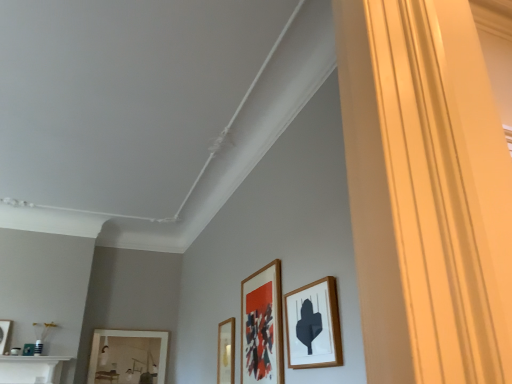
Question: Is matte white picture frame at lower left, which appears as the first picture frame when viewed from the left, wider than matte wooden picture frame at center, acting as the second picture frame starting from the right?

Choices:
 (A) yes
 (B) no

Answer: (A)

Question: From the image's perspective, is matte white picture frame at lower left, marked as the 2th picture frame in a back-to-front arrangement, beneath matte wooden picture frame at center, acting as the second picture frame starting from the right?

Choices:
 (A) yes
 (B) no

Answer: (A)

Question: Is matte white picture frame at lower left, the 5th picture frame from the right, not near matte wooden picture frame at center, the 4th picture frame positioned from the left?

Choices:
 (A) no
 (B) yes

Answer: (B)

Question: Can you confirm if matte white picture frame at lower left, which appears as the first picture frame when viewed from the left, is thinner than matte wooden picture frame at center, which is the fourth picture frame in back-to-front order?

Choices:
 (A) no
 (B) yes

Answer: (A)

Question: Can you confirm if matte white picture frame at lower left, which appears as the first picture frame when viewed from the left, is taller than matte wooden picture frame at center, marked as the second picture frame in a front-to-back arrangement?

Choices:
 (A) no
 (B) yes

Answer: (A)

Question: Is wooden picture frame at lower left, placed as the second picture frame when sorted from left to right, inside or outside of wooden picture frame at right, which is the fifth picture frame in back-to-front order?

Choices:
 (A) outside
 (B) inside

Answer: (A)

Question: From a real-world perspective, is wooden picture frame at lower left, the fourth picture frame positioned from the right, positioned above or below wooden picture frame at right, which ranks as the first picture frame in front-to-back order?

Choices:
 (A) above
 (B) below

Answer: (A)

Question: Is wooden picture frame at lower left, placed as the second picture frame when sorted from left to right, bigger or smaller than wooden picture frame at right, which ranks as the first picture frame in front-to-back order?

Choices:
 (A) small
 (B) big

Answer: (B)

Question: In terms of height, does wooden picture frame at lower left, which is the 5th picture frame from front to back, look taller or shorter compared to wooden picture frame at right, the 5th picture frame viewed from the left?

Choices:
 (A) short
 (B) tall

Answer: (B)

Question: In the image, is wooden picture frame at lower center, acting as the 3th picture frame starting from the front, positioned in front of or behind matte wooden picture frame at center, marked as the second picture frame in a front-to-back arrangement?

Choices:
 (A) front
 (B) behind

Answer: (B)

Question: Does point (233, 352) appear closer or farther from the camera than point (262, 331)?

Choices:
 (A) farther
 (B) closer

Answer: (A)

Question: From their relative heights in the image, would you say wooden picture frame at lower center, which is the 3th picture frame from right to left, is taller or shorter than matte wooden picture frame at center, which is the fourth picture frame in back-to-front order?

Choices:
 (A) tall
 (B) short

Answer: (B)

Question: Is wooden picture frame at lower center, positioned as the third picture frame in left-to-right order, bigger or smaller than matte wooden picture frame at center, the 4th picture frame positioned from the left?

Choices:
 (A) big
 (B) small

Answer: (B)

Question: From a real-world perspective, is wooden picture frame at lower left, the fourth picture frame positioned from the right, physically located above or below wooden picture frame at lower center, positioned as the 3th picture frame in back-to-front order?

Choices:
 (A) below
 (B) above

Answer: (B)

Question: In the image, is wooden picture frame at lower left, placed as the second picture frame when sorted from left to right, on the left side or the right side of wooden picture frame at lower center, acting as the 3th picture frame starting from the front?

Choices:
 (A) right
 (B) left

Answer: (B)